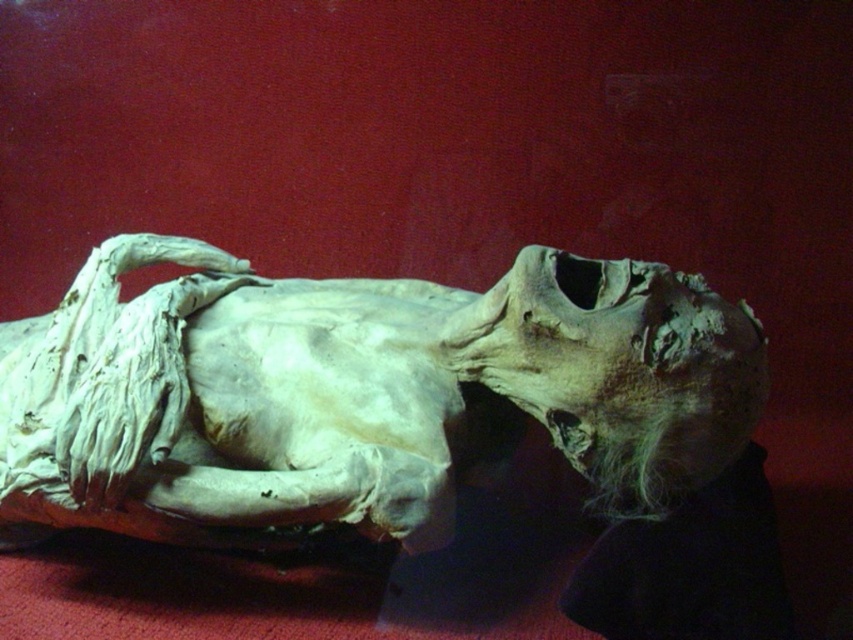
Does point (67, 467) come farther from viewer compared to point (648, 468)?

Yes, it is behind point (648, 468).

This screenshot has height=640, width=853. Describe the element at coordinates (358, 396) in the screenshot. I see `white papier-mâché mummy at center` at that location.

Does point (393, 310) come in front of point (590, 304)?

No, (393, 310) is further to viewer.

I want to click on white papier-mâché mummy at center, so click(x=358, y=396).